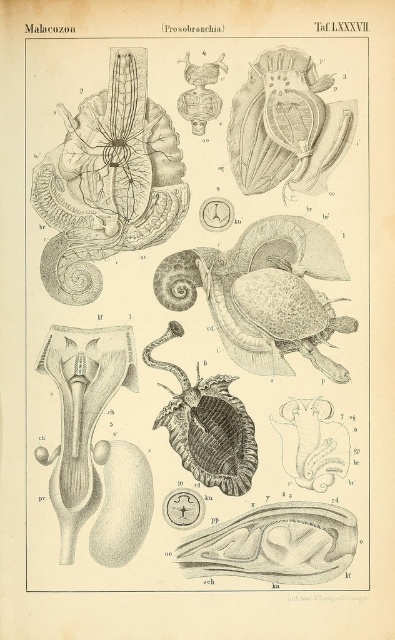
Question: Can you confirm if smooth gray shell at center is wider than smooth brown snail at upper left?

Choices:
 (A) yes
 (B) no

Answer: (A)

Question: Which object is positioned closest to the smooth brown snail at center?

Choices:
 (A) smooth gray shell at center
 (B) smooth brown snail at upper left

Answer: (A)

Question: Based on their relative distances, which object is nearer to the smooth beige shell at upper center?

Choices:
 (A) smooth brown snail at center
 (B) shiny brown shell at center

Answer: (A)

Question: Can you confirm if smooth gray shell at center is bigger than smooth brown snail at upper left?

Choices:
 (A) yes
 (B) no

Answer: (A)

Question: Which is nearer to the smooth brown snail at center?

Choices:
 (A) smooth beige shell at upper center
 (B) smooth brown snail at upper left
 (C) shiny brown shell at center
 (D) smooth gray shell at center

Answer: (D)

Question: Is smooth brown snail at upper left smaller than smooth beige shell at upper center?

Choices:
 (A) yes
 (B) no

Answer: (A)